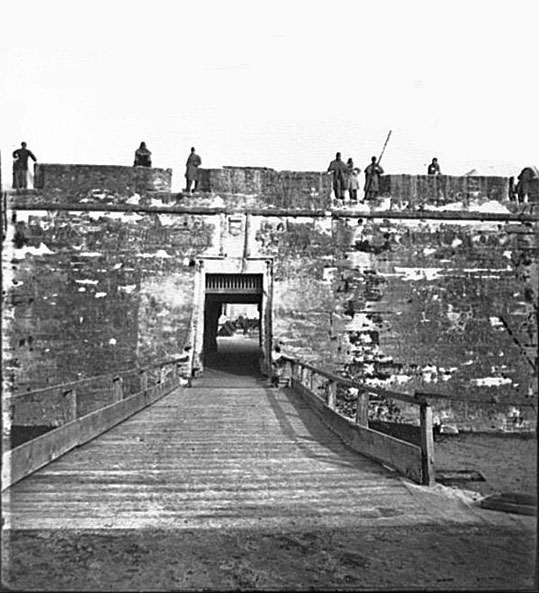
Locate an element on the screen. shadow cast through entryway hallway is located at coordinates (474, 444), (238, 356).